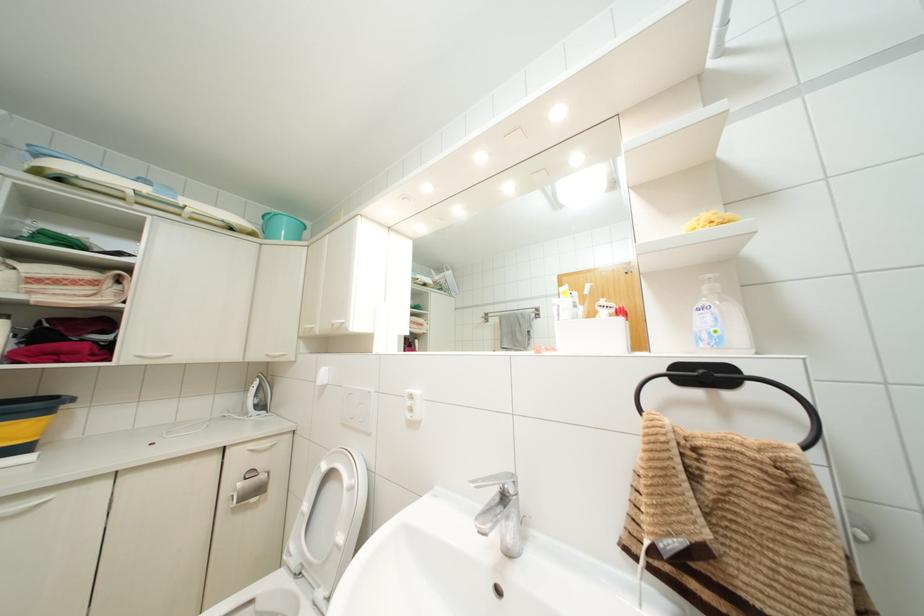
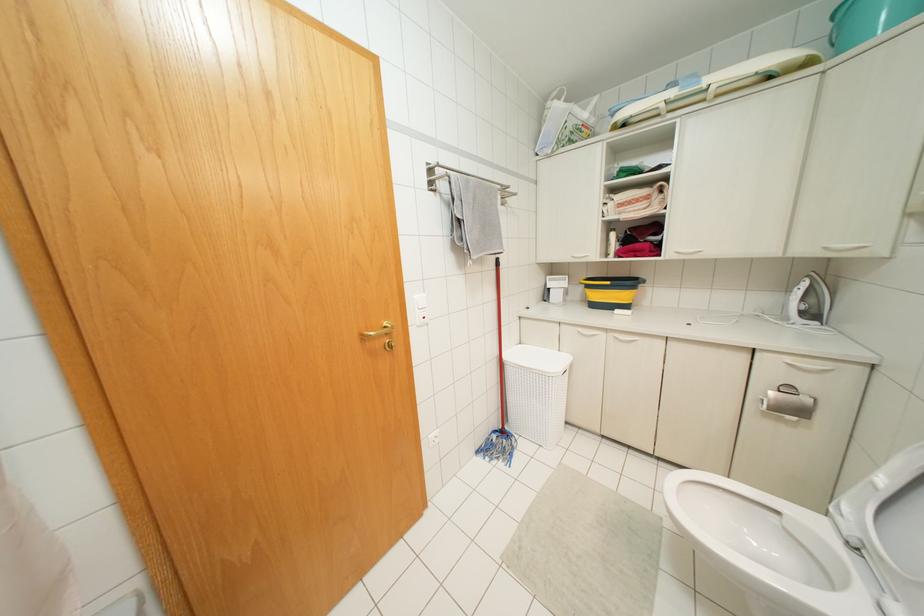
Question: The camera is either moving clockwise (left) or counter-clockwise (right) around the object. The first image is from the beginning of the video and the second image is from the end. Is the camera moving left or right when shooting the video?

Choices:
 (A) Left
 (B) Right

Answer: (B)